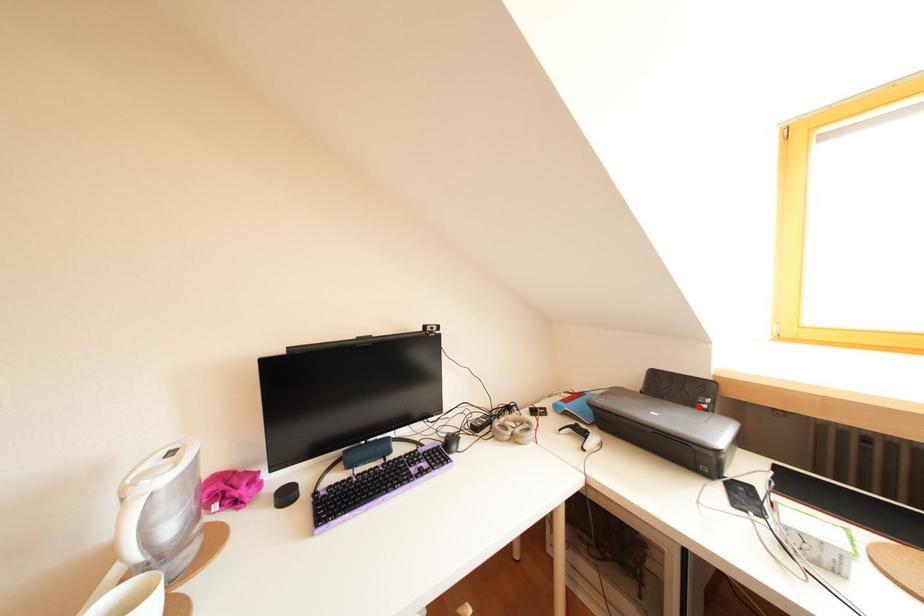
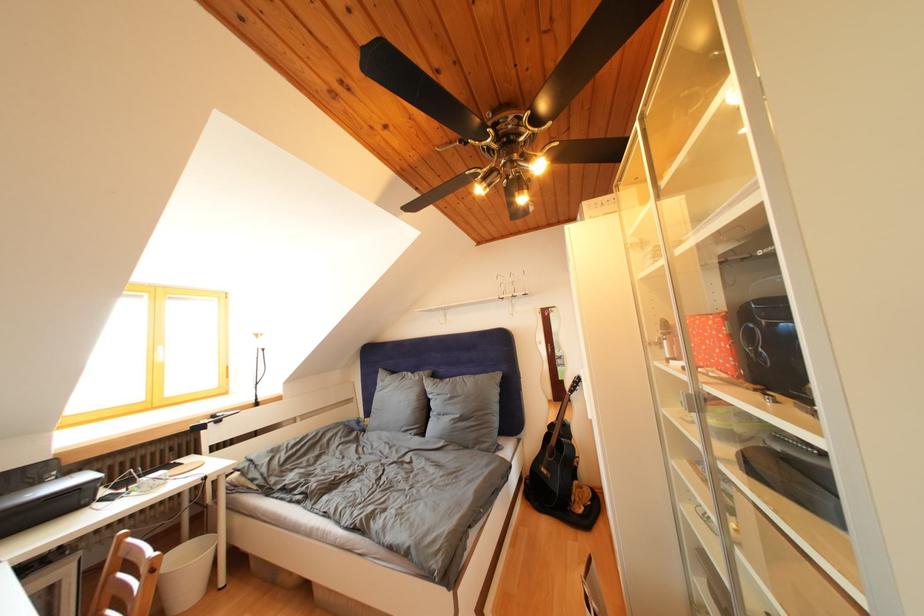
Question: I am providing you with two images of the same scene from different viewpoints. In image1, a red point is highlighted. Considering the same 3D point in image2, which of the following is correct?

Choices:
 (A) It is closer
 (B) It is farther

Answer: (A)